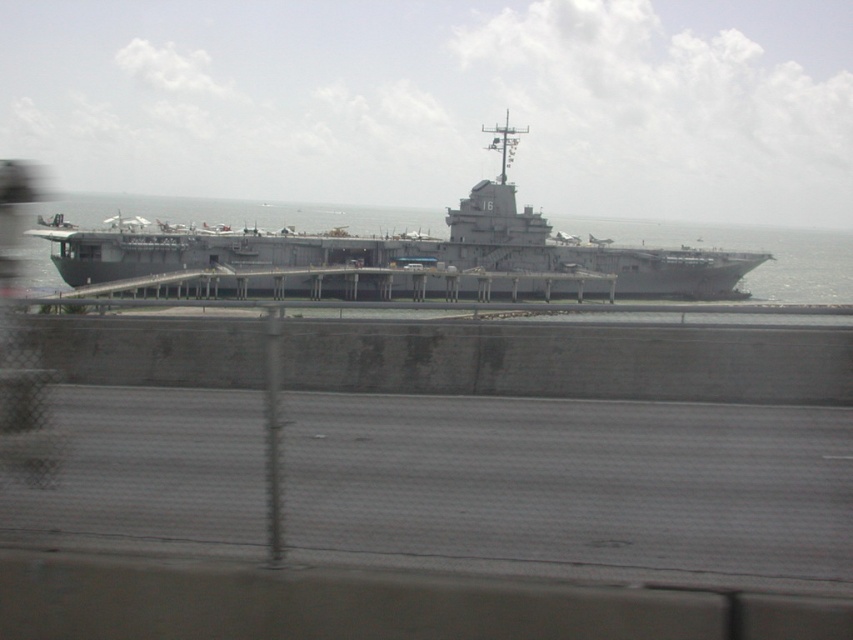
You are standing at the edge of the port and looking at the aircraft carrier. There are two points marked on the deck of the carrier. Which point, point [73,276] or point [842,266], is closer to you?

Point [73,276] is closer to the viewer than point [842,266].